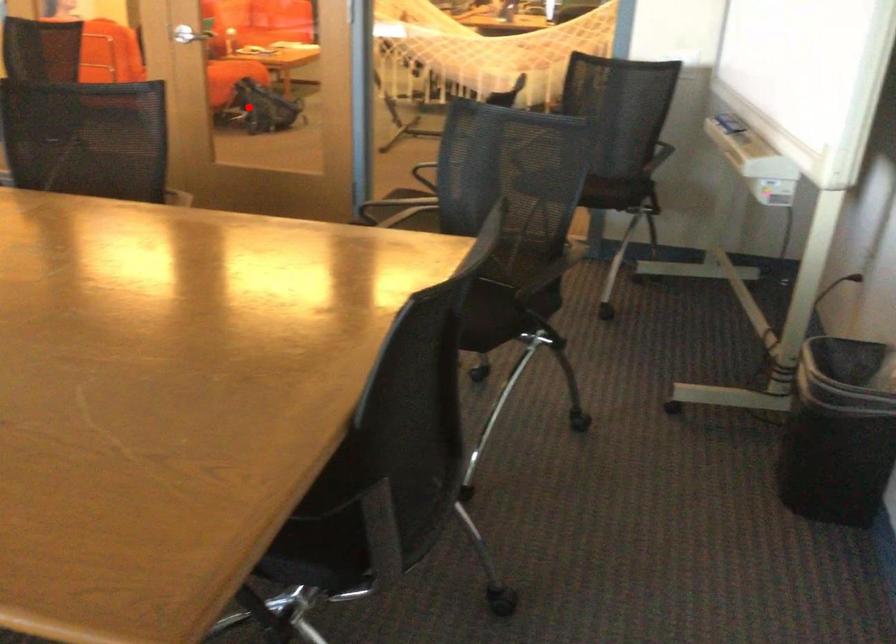
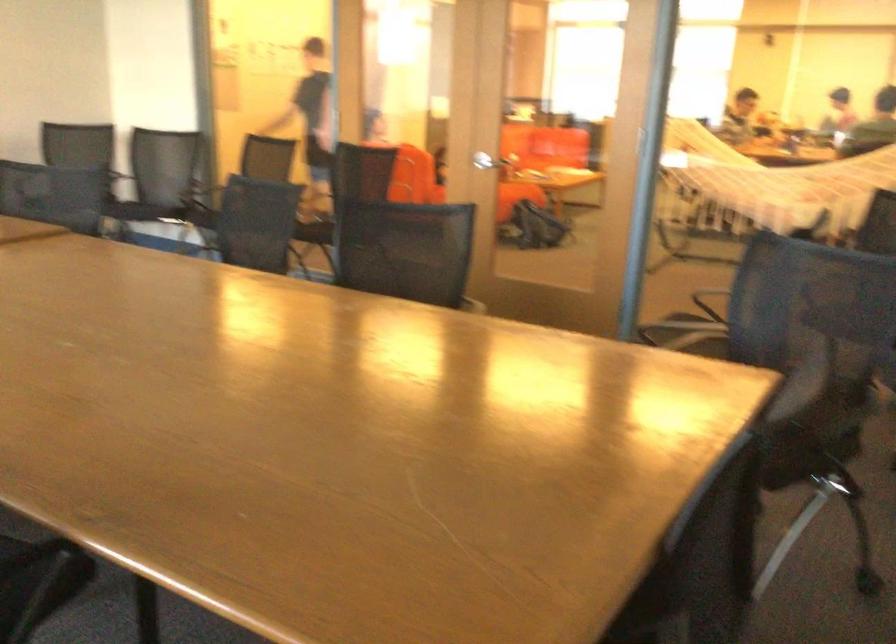
In the second image, find the point that corresponds to the highlighted location in the first image.

(533, 228)